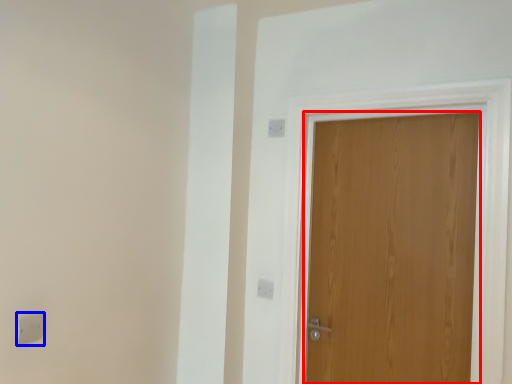
Question: Which object appears closest to the camera in this image, door (highlighted by a red box) or light switch (highlighted by a blue box)?

Choices:
 (A) door
 (B) light switch

Answer: (B)